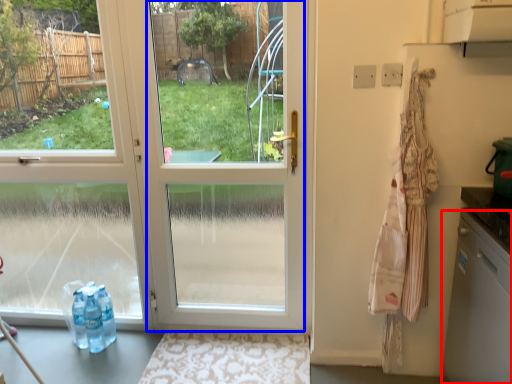
Question: Which object appears farthest to the camera in this image, dish washer (highlighted by a red box) or glass door (highlighted by a blue box)?

Choices:
 (A) dish washer
 (B) glass door

Answer: (B)